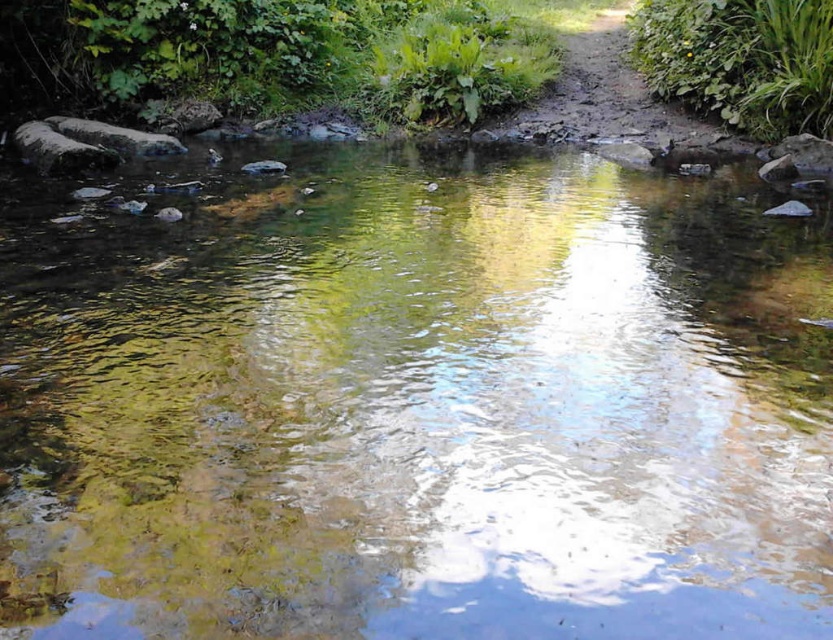
Is point (392, 0) positioned after point (597, 100)?

Yes.

Between point (1, 76) and point (576, 68), which one is positioned in front?

Point (1, 76) is in front.

I want to click on green leafy plants at upper center, so click(x=198, y=49).

You are a GUI agent. You are given a task and a screenshot of the screen. Output one action in this format:
    pyautogui.click(x=<x>, y=<y>)
    Task: Click on the green leafy plants at upper center
    
    Given the screenshot: What is the action you would take?
    pyautogui.click(x=198, y=49)

Is green leafy plant at upper right thinner than dirt path at upper center?

In fact, green leafy plant at upper right might be wider than dirt path at upper center.

Which of these two, green leafy plant at upper right or dirt path at upper center, stands shorter?

dirt path at upper center is shorter.

Does point (757, 90) come behind point (571, 65)?

No, it is in front of (571, 65).

Where is `green leafy plant at upper right`? The width and height of the screenshot is (833, 640). green leafy plant at upper right is located at coordinates (741, 60).

Which is in front, point (97, 104) or point (814, 88)?

Point (814, 88)

Between point (467, 22) and point (746, 52), which one is positioned behind?

Point (467, 22)

Where is `green leafy plants at upper center`? This screenshot has width=833, height=640. green leafy plants at upper center is located at coordinates (198, 49).